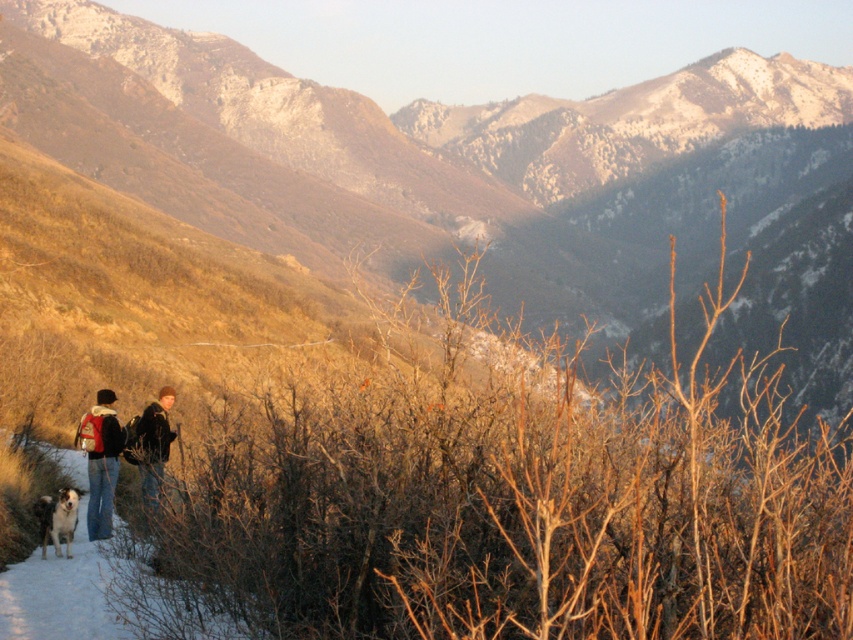
You are planning to set up a small tent for shelter on the brown grassy hillside at lower left. However, you also need to keep the black and white fur dog at lower left nearby. Based on the scene description, can the hillside accommodate both the tent and the dog comfortably?

The brown grassy hillside at lower left might be wider than the black and white fur dog at lower left, so there is likely enough space to set up the tent and have the dog stay nearby comfortably.

You are a photographer standing at the edge of the snow path. You want to take a photo of the two subjects at lower left. Which one should you focus on first if you want to capture the denim jacket at lower left and the black and white fur dog at lower left in the same frame?

The denim jacket at lower left has a greater height compared to the black and white fur dog at lower left, so you should focus on the denim jacket at lower left first to ensure both are in frame.

You are a hiker who wants to take a photo of the two people and the dog. You notice that the denim jacket at lower left and the black and white fur dog at lower left are close to each other. Which one should you focus on first if you want to capture them both in the frame without moving the camera?

You should focus on the denim jacket at lower left first because it is positioned to the left of the black and white fur dog at lower left, so capturing it first ensures both are in the frame without needing to adjust the camera position.